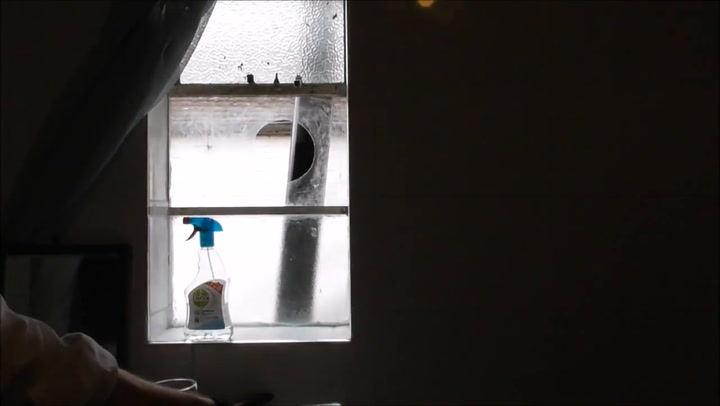
You are a GUI agent. You are given a task and a screenshot of the screen. Output one action in this format:
    pyautogui.click(x=<x>, y=<y>)
    Task: Click on the frosted translucent glass
    Image resolution: width=720 pixels, height=406 pixels.
    Given the screenshot: What is the action you would take?
    pyautogui.click(x=286, y=45)